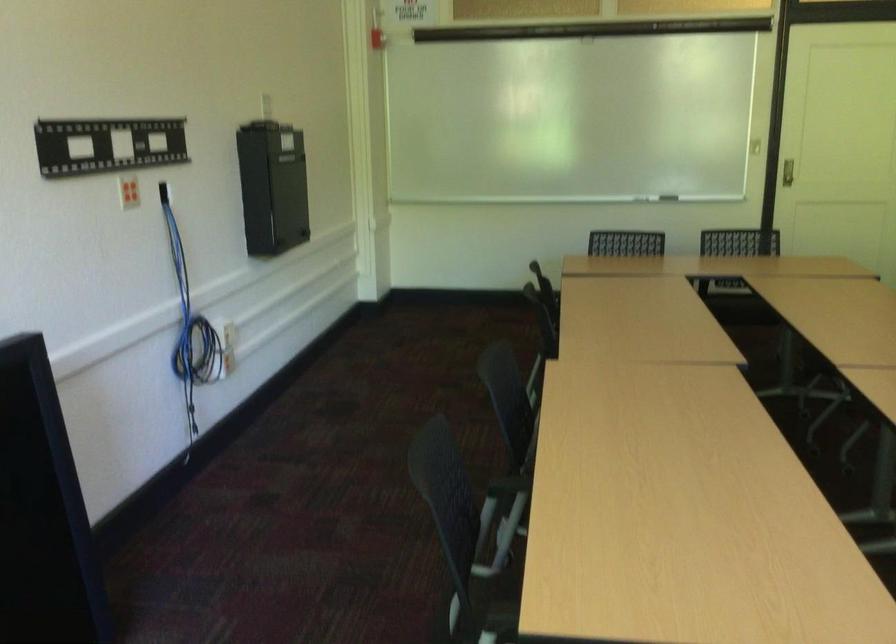
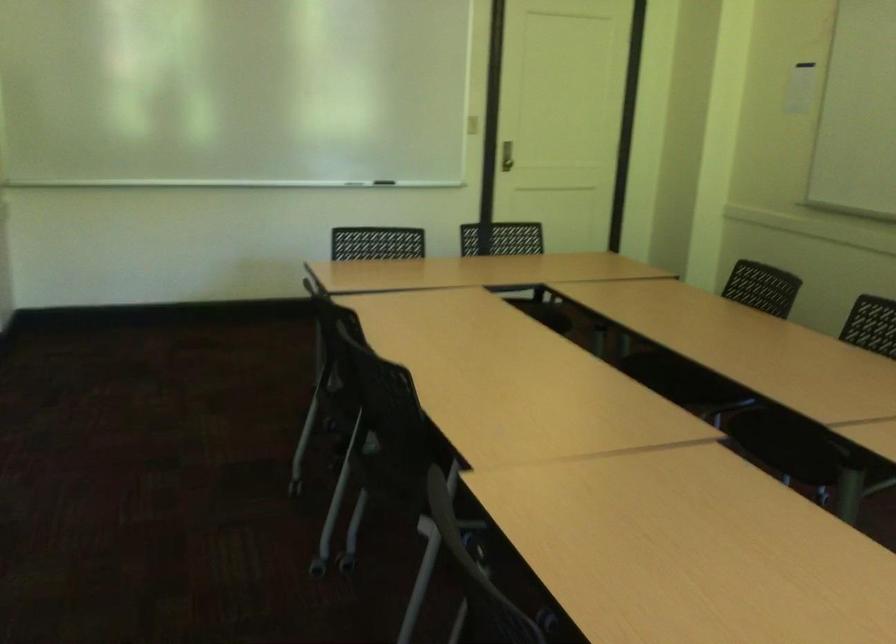
Question: I am providing you with two images of the same scene from different viewpoints. After the viewpoint changes to image2, which objects are now occluded?

Choices:
 (A) whiteboard eraser
 (B) white mail box
 (C) chair sitting surface
 (D) metal door handle

Answer: (A)